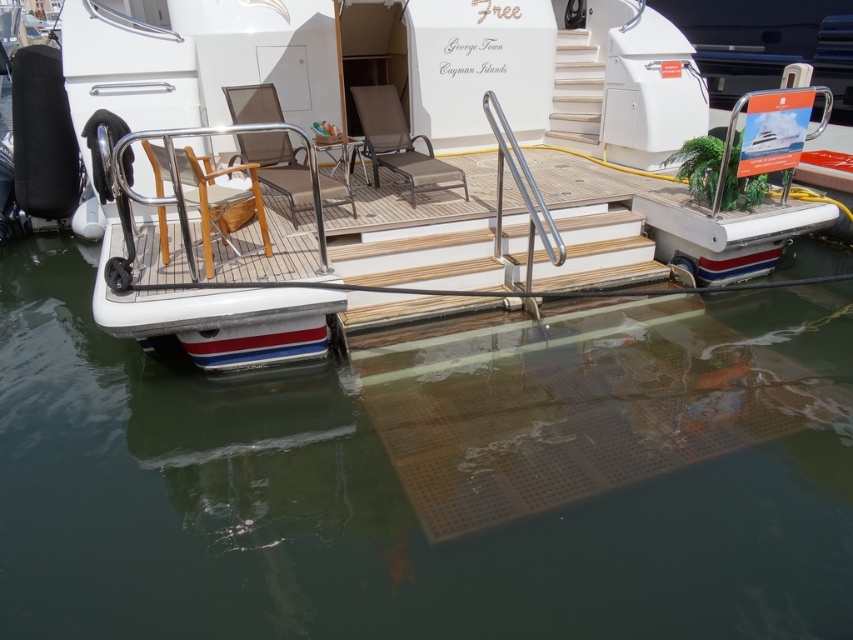
Can you confirm if clear water at lower center is positioned below brown fabric chaise lounge at center?

Indeed, clear water at lower center is positioned under brown fabric chaise lounge at center.

Between clear water at lower center and brown fabric chaise lounge at center, which one appears on the right side from the viewer's perspective?

clear water at lower center is more to the right.

Image resolution: width=853 pixels, height=640 pixels. Describe the element at coordinates (431, 476) in the screenshot. I see `clear water at lower center` at that location.

Locate an element on the screen. clear water at lower center is located at coordinates [431, 476].

Locate an element on the screen. The image size is (853, 640). white glossy boat at center is located at coordinates (378, 173).

Which is more to the right, white glossy boat at center or wooden chair at center?

white glossy boat at center

What do you see at coordinates (378, 173) in the screenshot? The height and width of the screenshot is (640, 853). I see `white glossy boat at center` at bounding box center [378, 173].

Find the location of a particular element. This screenshot has width=853, height=640. white glossy boat at center is located at coordinates (378, 173).

Is clear water at lower center to the right of brown mesh chair at center from the viewer's perspective?

Indeed, clear water at lower center is positioned on the right side of brown mesh chair at center.

Does clear water at lower center appear over brown mesh chair at center?

Incorrect, clear water at lower center is not positioned above brown mesh chair at center.

Is point (190, 438) farther from camera compared to point (229, 160)?

No, it is not.

Locate an element on the screen. The width and height of the screenshot is (853, 640). clear water at lower center is located at coordinates (431, 476).